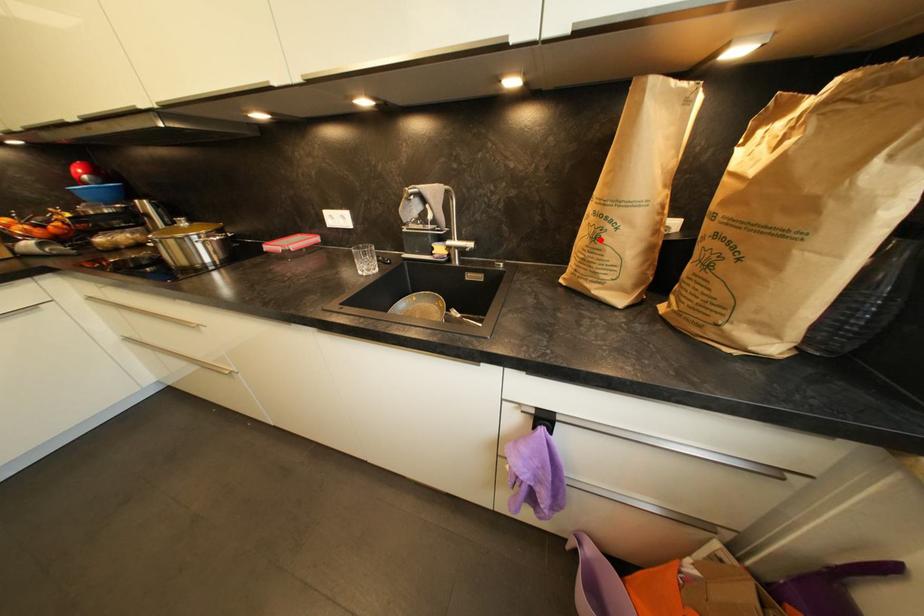
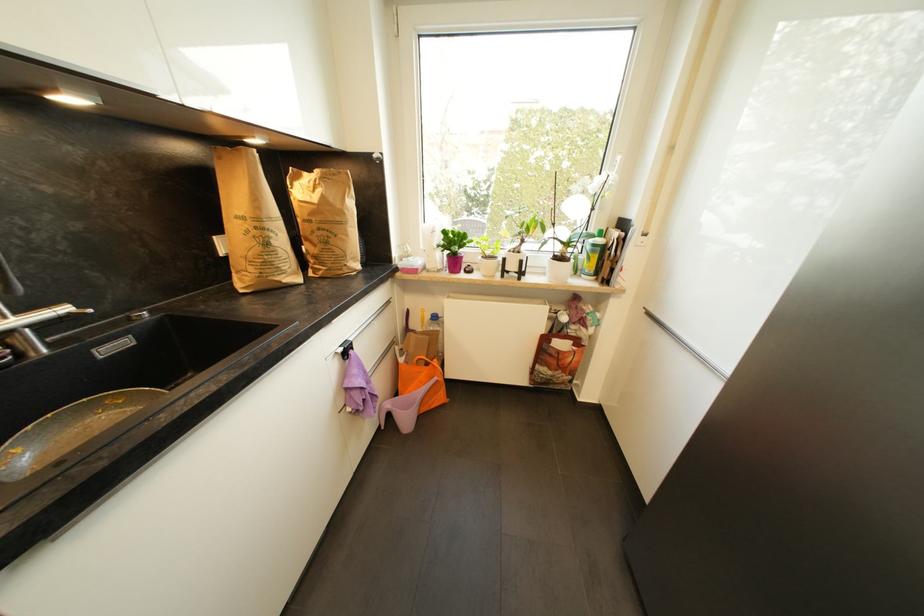
The point at the highlighted location is marked in the first image. Where is the corresponding point in the second image?

(272, 246)